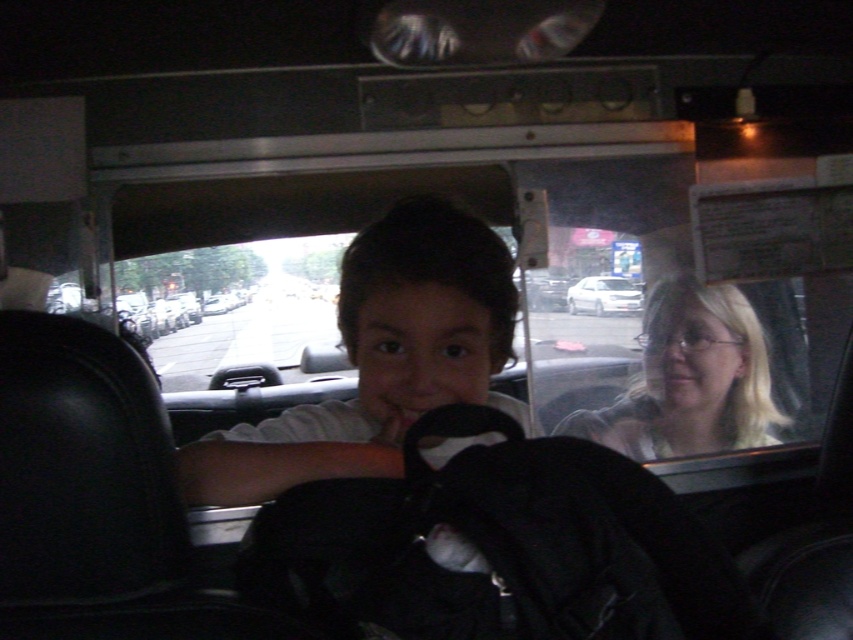
Question: In this image, where is smooth skin child at center located relative to white glossy sedan at center?

Choices:
 (A) below
 (B) above

Answer: (A)

Question: Which object appears closest to the camera in this image?

Choices:
 (A) smooth skin child at center
 (B) white glossy sedan at center

Answer: (A)

Question: Which of the following is the farthest from the observer?

Choices:
 (A) smooth skin child at center
 (B) white glossy sedan at center
 (C) blonde hair at center

Answer: (B)

Question: Estimate the real-world distances between objects in this image. Which object is farther from the blonde hair at center?

Choices:
 (A) smooth skin child at center
 (B) white glossy sedan at center

Answer: (A)

Question: Does smooth skin child at center appear on the left side of blonde hair at center?

Choices:
 (A) no
 (B) yes

Answer: (B)

Question: Is blonde hair at center closer to camera compared to white glossy sedan at center?

Choices:
 (A) no
 (B) yes

Answer: (B)